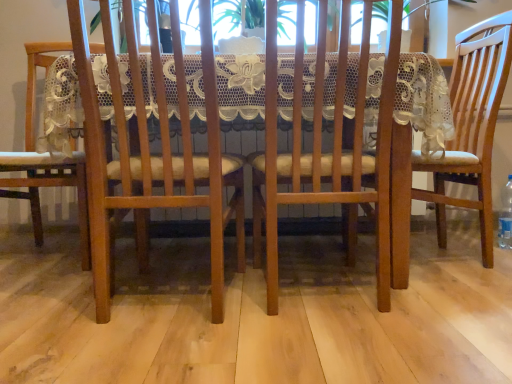
Question: Is matte wood chair at left, the fourth chair viewed from the right, touching wooden chair at center, placed as the second chair when sorted from left to right?

Choices:
 (A) no
 (B) yes

Answer: (A)

Question: Is matte wood chair at left, acting as the first chair starting from the left, completely or partially outside of wooden chair at center, placed as the second chair when sorted from left to right?

Choices:
 (A) no
 (B) yes

Answer: (B)

Question: Does matte wood chair at left, acting as the first chair starting from the left, have a lesser width compared to wooden chair at center, which is the 3th chair in right-to-left order?

Choices:
 (A) no
 (B) yes

Answer: (A)

Question: Considering the relative positions of matte wood chair at left, the fourth chair viewed from the right, and wooden chair at center, placed as the second chair when sorted from left to right, in the image provided, is matte wood chair at left, the fourth chair viewed from the right, to the right of wooden chair at center, placed as the second chair when sorted from left to right, from the viewer's perspective?

Choices:
 (A) no
 (B) yes

Answer: (A)

Question: Would you say matte wood chair at left, the fourth chair viewed from the right, contains wooden chair at center, which is the 3th chair in right-to-left order?

Choices:
 (A) yes
 (B) no

Answer: (B)

Question: From the image's perspective, is matte wood chair at left, acting as the first chair starting from the left, on top of wooden chair at center, placed as the second chair when sorted from left to right?

Choices:
 (A) yes
 (B) no

Answer: (A)

Question: Considering the relative sizes of wooden table at center and matte wood chair at left, the fourth chair viewed from the right, in the image provided, is wooden table at center wider than matte wood chair at left, the fourth chair viewed from the right,?

Choices:
 (A) no
 (B) yes

Answer: (B)

Question: Are wooden table at center and matte wood chair at left, the fourth chair viewed from the right, located far from each other?

Choices:
 (A) yes
 (B) no

Answer: (B)

Question: Is wooden table at center looking in the opposite direction of matte wood chair at left, the fourth chair viewed from the right?

Choices:
 (A) no
 (B) yes

Answer: (A)

Question: From the image's perspective, is wooden table at center under matte wood chair at left, the fourth chair viewed from the right?

Choices:
 (A) yes
 (B) no

Answer: (A)

Question: Is wooden table at center closer to the viewer compared to matte wood chair at left, acting as the first chair starting from the left?

Choices:
 (A) no
 (B) yes

Answer: (B)

Question: Could you tell me if wooden table at center is turned towards matte wood chair at left, acting as the first chair starting from the left?

Choices:
 (A) yes
 (B) no

Answer: (B)

Question: Does matte wood chair at left, the fourth chair viewed from the right, have a lesser height compared to clear plastic bottle at lower right?

Choices:
 (A) yes
 (B) no

Answer: (B)